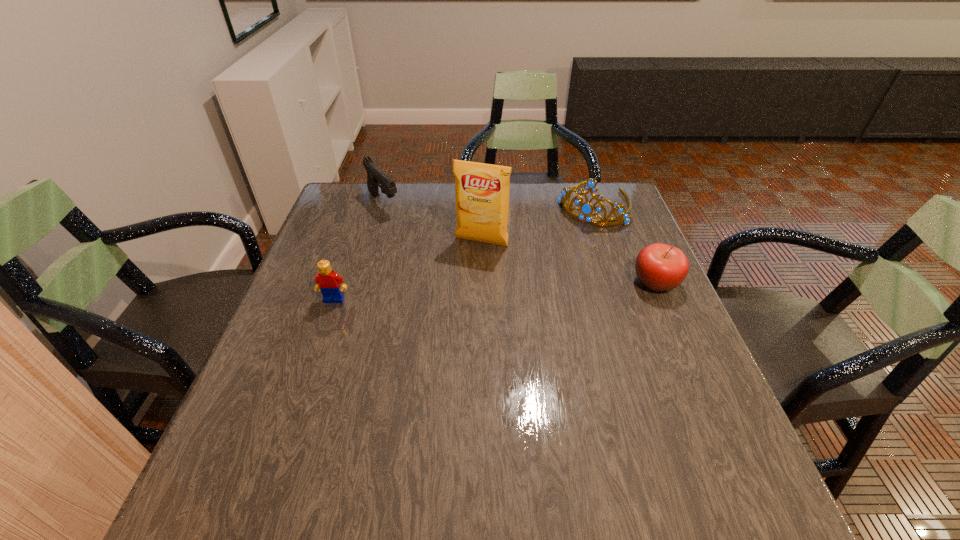
The height and width of the screenshot is (540, 960). Identify the location of pistol positioned at the left edge. (375, 176).

Where is `apple at the right edge`? The image size is (960, 540). apple at the right edge is located at coordinates (660, 267).

You are a GUI agent. You are given a task and a screenshot of the screen. Output one action in this format:
    pyautogui.click(x=<x>, y=<y>)
    Task: Click on the tiara that is at the right edge
    Image resolution: width=960 pixels, height=540 pixels.
    Given the screenshot: What is the action you would take?
    pos(586,209)

This screenshot has height=540, width=960. What are the coordinates of `object situated at the far left corner` in the screenshot? It's located at (375, 176).

Locate an element on the screen. The image size is (960, 540). object located in the far right corner section of the desktop is located at coordinates (586, 209).

Locate an element on the screen. Image resolution: width=960 pixels, height=540 pixels. free space at the far edge is located at coordinates (444, 214).

Where is `vacant space at the near edge of the desktop`? This screenshot has width=960, height=540. vacant space at the near edge of the desktop is located at coordinates (457, 422).

I want to click on vacant space at the left edge of the desktop, so click(264, 360).

Where is `vacant space at the right edge of the desktop`? vacant space at the right edge of the desktop is located at coordinates (633, 273).

The image size is (960, 540). In the image, there is a desktop. Find the location of `free region at the far right corner`. free region at the far right corner is located at coordinates (603, 213).